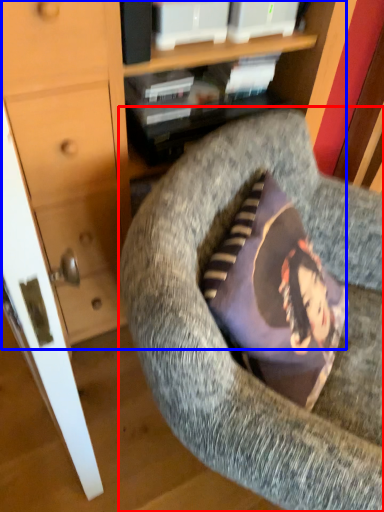
Question: Which of the following is the farthest to the observer, chair (highlighted by a red box) or dresser (highlighted by a blue box)?

Choices:
 (A) chair
 (B) dresser

Answer: (B)